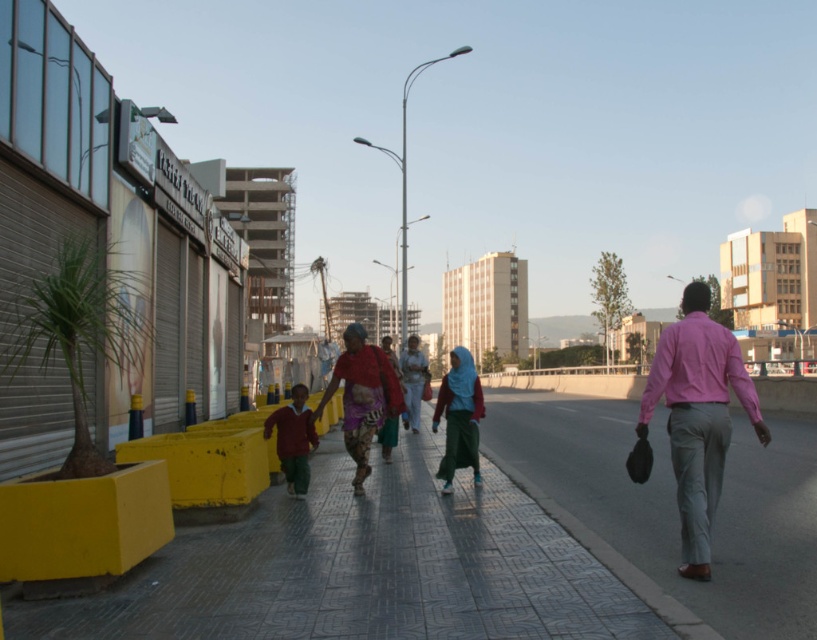
Which is more to the right, gray concrete sidewalk at center or matte green skirt at center?

gray concrete sidewalk at center is more to the right.

Who is lower down, gray concrete sidewalk at center or matte green skirt at center?

gray concrete sidewalk at center

Find the location of a particular element. Image resolution: width=817 pixels, height=640 pixels. gray concrete sidewalk at center is located at coordinates (675, 502).

Can you confirm if smooth concrete pavement at center is smaller than multicolored fabric dress at center?

Indeed, smooth concrete pavement at center has a smaller size compared to multicolored fabric dress at center.

Looking at this image, does smooth concrete pavement at center appear on the left side of multicolored fabric dress at center?

In fact, smooth concrete pavement at center is to the right of multicolored fabric dress at center.

Does point (404, 627) come closer to viewer compared to point (342, 396)?

That is True.

Find the location of a particular element. smooth concrete pavement at center is located at coordinates (371, 570).

Does gray concrete sidewalk at center have a greater height compared to multicolored fabric dress at center?

Yes, gray concrete sidewalk at center is taller than multicolored fabric dress at center.

Which is more to the left, gray concrete sidewalk at center or multicolored fabric dress at center?

Positioned to the left is multicolored fabric dress at center.

Is point (615, 520) in front of point (364, 342)?

That is True.

This screenshot has width=817, height=640. What are the coordinates of `gray concrete sidewalk at center` in the screenshot? It's located at (675, 502).